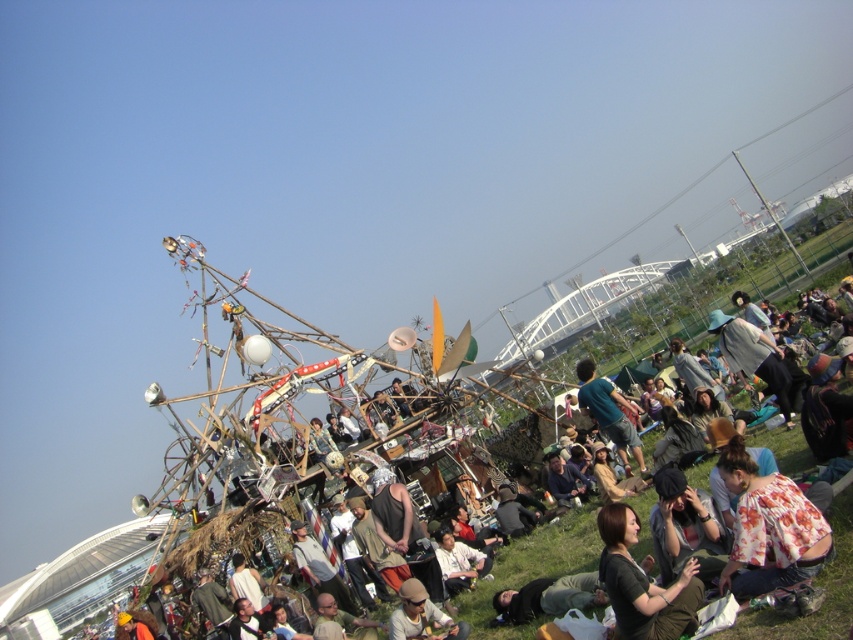
Which is in front, point (509, 557) or point (627, 579)?

Positioned in front is point (627, 579).

Can you confirm if wooden sculpture at center is thinner than black fabric shirt at lower right?

In fact, wooden sculpture at center might be wider than black fabric shirt at lower right.

What do you see at coordinates (532, 566) in the screenshot?
I see `wooden sculpture at center` at bounding box center [532, 566].

The width and height of the screenshot is (853, 640). I want to click on wooden sculpture at center, so click(x=532, y=566).

How distant is floral print blouse at lower right from green fabric shirt at center?

They are 30.93 meters apart.

Consider the image. Does floral print blouse at lower right appear over green fabric shirt at center?

Incorrect, floral print blouse at lower right is not positioned above green fabric shirt at center.

Which is behind, point (780, 532) or point (601, 381)?

The point (601, 381) is more distant.

The width and height of the screenshot is (853, 640). What are the coordinates of `floral print blouse at lower right` in the screenshot? It's located at (769, 529).

Is floral print blouse at lower right above black fabric shirt at lower right?

Yes, floral print blouse at lower right is above black fabric shirt at lower right.

Does point (770, 515) come in front of point (624, 536)?

Yes, point (770, 515) is in front of point (624, 536).

What are the coordinates of `floral print blouse at lower right` in the screenshot? It's located at (769, 529).